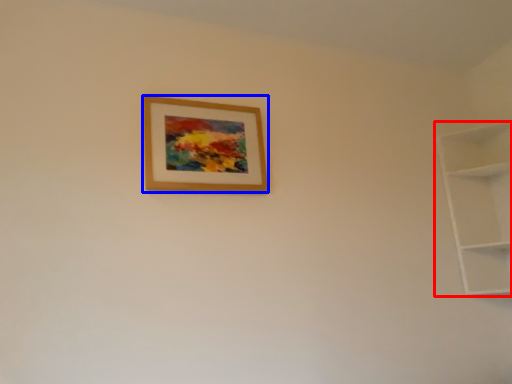
Question: Among these objects, which one is nearest to the camera, shelf (highlighted by a red box) or picture frame (highlighted by a blue box)?

Choices:
 (A) shelf
 (B) picture frame

Answer: (B)